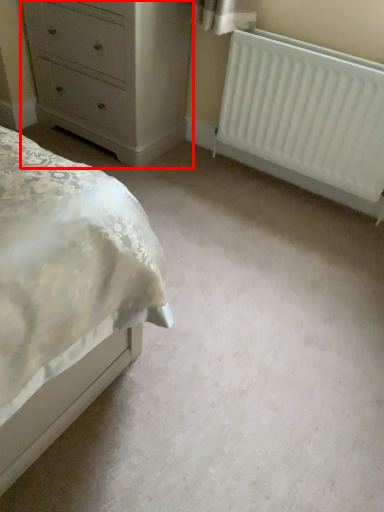
Question: In this image, where is chest of drawers (annotated by the red box) located relative to radiator?

Choices:
 (A) right
 (B) left

Answer: (B)